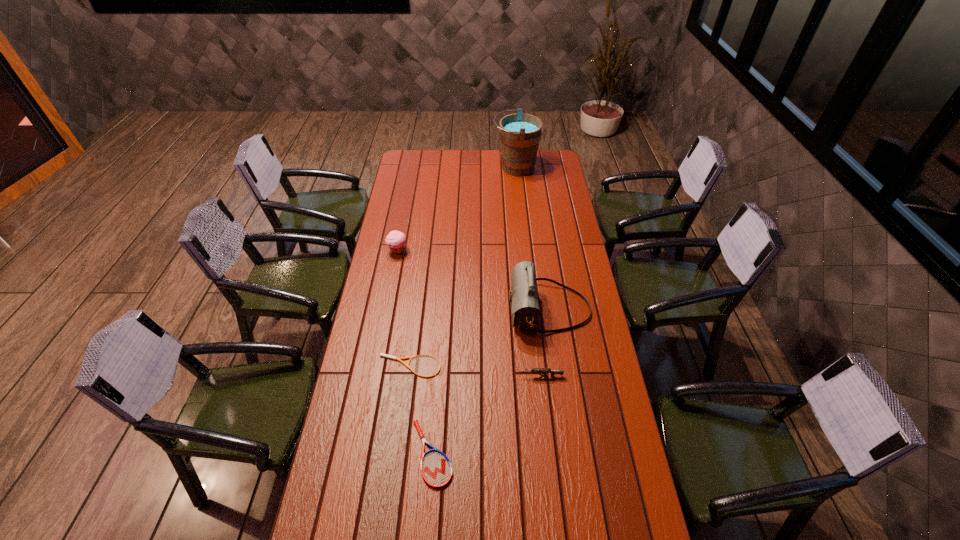
Where is `wine bucket`? The image size is (960, 540). wine bucket is located at coordinates (519, 133).

Locate an element on the screen. The height and width of the screenshot is (540, 960). the farthest object is located at coordinates (519, 133).

Where is `the fourth nearest object`? the fourth nearest object is located at coordinates (524, 300).

The image size is (960, 540). I want to click on shoulder bag, so click(x=524, y=300).

Identify the location of the fifth nearest object. (395, 240).

Find the location of a particular element. The height and width of the screenshot is (540, 960). cupcake is located at coordinates (395, 240).

Find the location of a particular element. gun is located at coordinates (552, 372).

Locate an element on the screen. The height and width of the screenshot is (540, 960). the nearer tennis racket is located at coordinates (436, 469).

Where is `the farther tennis racket`? the farther tennis racket is located at coordinates (381, 354).

Find the location of `vacant space situated with a handle on the side of the tallest object`. vacant space situated with a handle on the side of the tallest object is located at coordinates (453, 167).